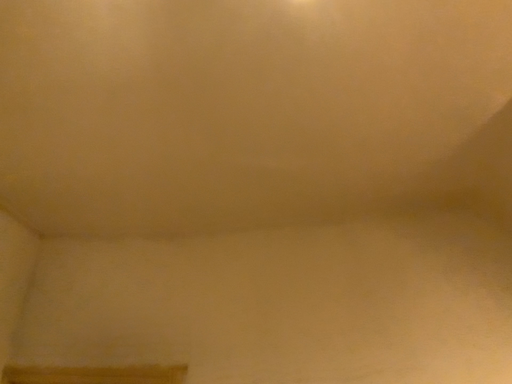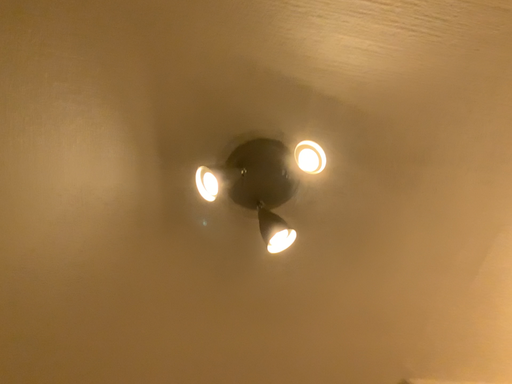
Question: How did the camera likely rotate when shooting the video?

Choices:
 (A) rotated downward
 (B) rotated upward

Answer: (B)